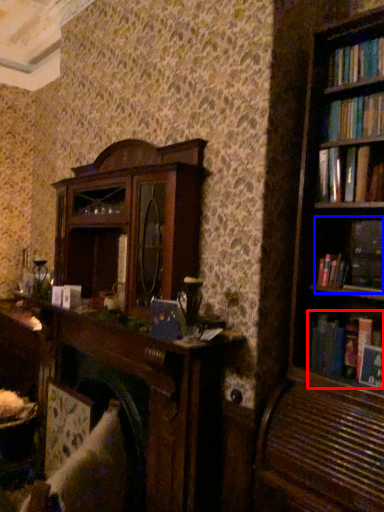
Question: Which object is closer to the camera taking this photo, book (highlighted by a red box) or book (highlighted by a blue box)?

Choices:
 (A) book
 (B) book

Answer: (B)